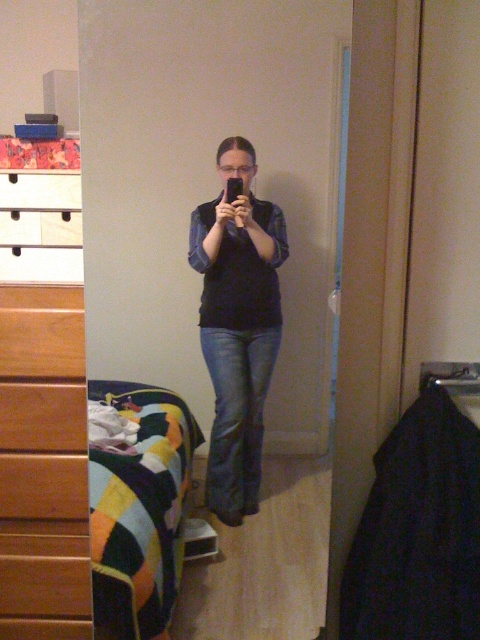
Between wooden dresser at left and multicolored fabric bed at lower left, which one has less height?

multicolored fabric bed at lower left is shorter.

Can you confirm if wooden dresser at left is smaller than multicolored fabric bed at lower left?

No, wooden dresser at left is not smaller than multicolored fabric bed at lower left.

Which is behind, point (79, 390) or point (170, 541)?

The point (170, 541) is more distant.

The height and width of the screenshot is (640, 480). What are the coordinates of `wooden dresser at left` in the screenshot? It's located at (43, 465).

Is point (27, 221) positioned in front of point (12, 202)?

No, it is behind (12, 202).

Which of these two, white wood drawer at upper left or brushed metal drawer at left, stands taller?

white wood drawer at upper left

The width and height of the screenshot is (480, 640). Identify the location of white wood drawer at upper left. (40, 228).

Is wooden dresser at left thinner than denim jeans at center?

Yes, wooden dresser at left is thinner than denim jeans at center.

Does point (9, 314) lie in front of point (237, 371)?

Yes, it is in front of point (237, 371).

Locate an element on the screen. The width and height of the screenshot is (480, 640). wooden dresser at left is located at coordinates coord(43,465).